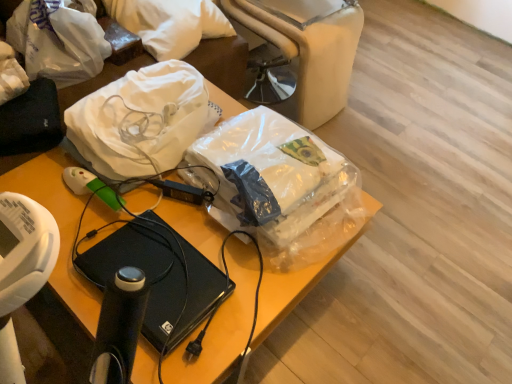
You are a GUI agent. You are given a task and a screenshot of the screen. Output one action in this format:
    pyautogui.click(x=<x>, y=<y>)
    Task: Click on the free space that is in between black matte laptop at center and translucent plastic bag at center, which appears as the 1th plastic bag when viewed from the right
    The width and height of the screenshot is (512, 384).
    Given the screenshot: What is the action you would take?
    pyautogui.click(x=209, y=259)